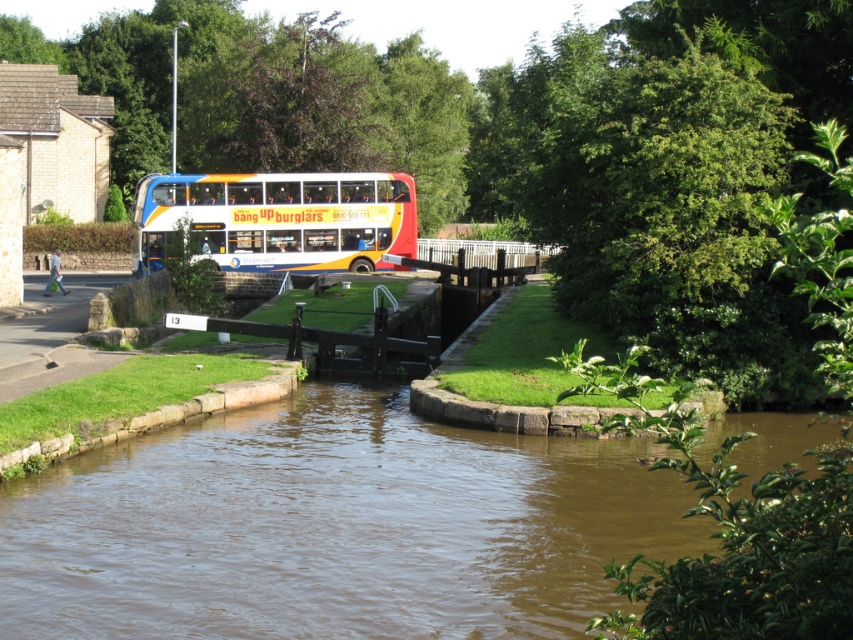
Question: Among these points, which one is farthest from the camera?

Choices:
 (A) (341, 390)
 (B) (219, 186)

Answer: (B)

Question: Is brown muddy water at center wider than white glossy double-decker bus at center?

Choices:
 (A) no
 (B) yes

Answer: (B)

Question: Which point is closer to the camera?

Choices:
 (A) brown muddy water at center
 (B) white glossy double-decker bus at center

Answer: (A)

Question: Is brown muddy water at center thinner than white glossy double-decker bus at center?

Choices:
 (A) no
 (B) yes

Answer: (A)

Question: Does brown muddy water at center have a lesser width compared to white glossy double-decker bus at center?

Choices:
 (A) no
 (B) yes

Answer: (A)